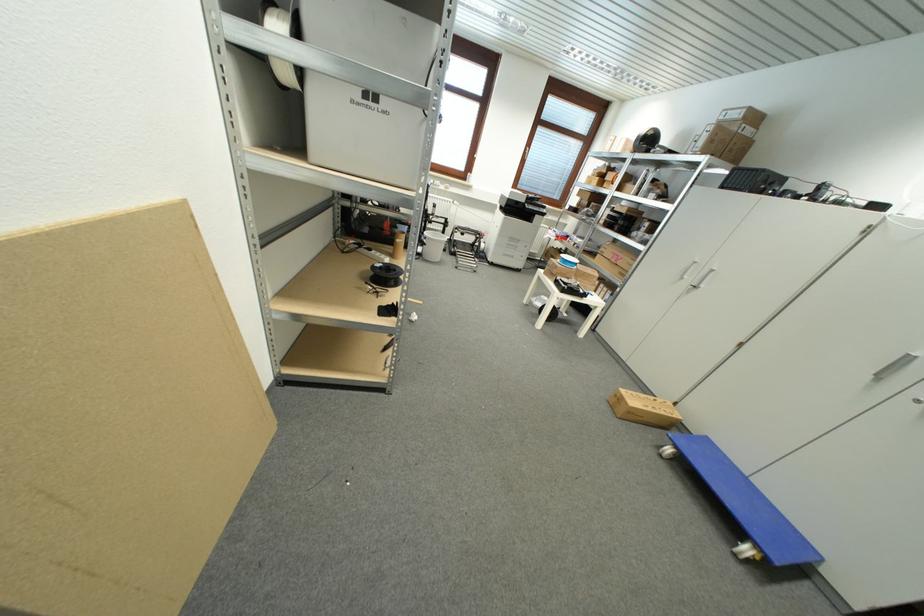
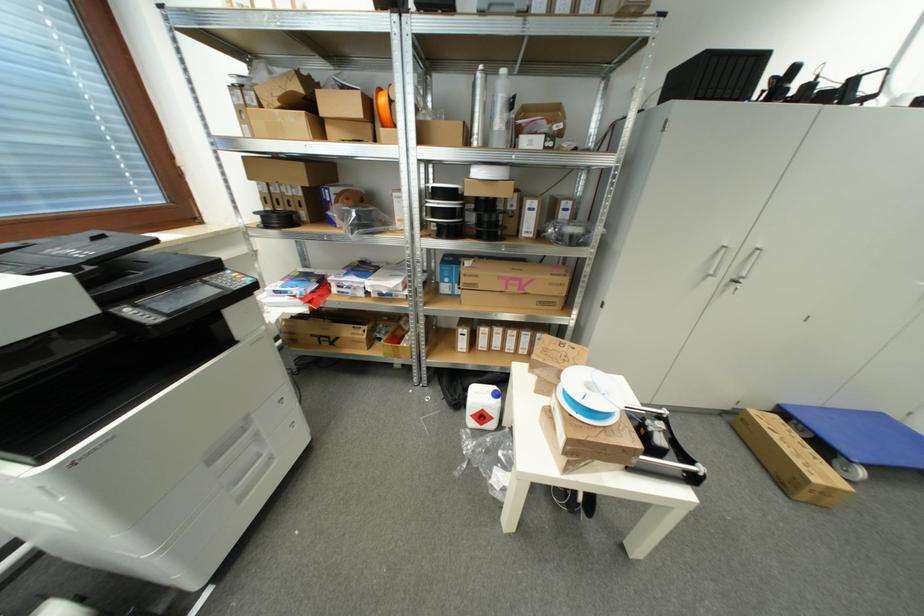
Find the pixel in the second image that matches (x=520, y=249) in the first image.

(261, 438)